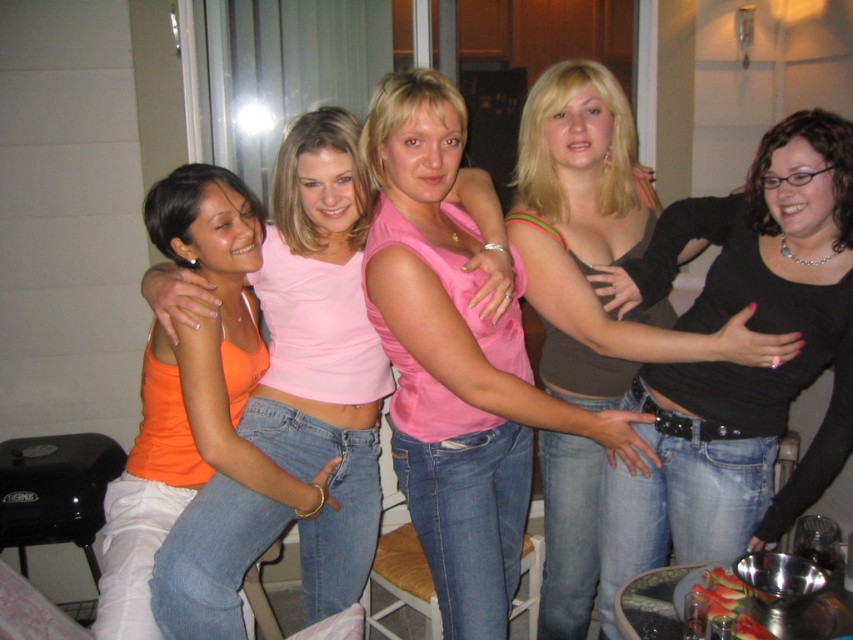
From the picture: Does pink matte tank top at center appear under orange matte tank top at center?

Actually, pink matte tank top at center is above orange matte tank top at center.

Who is positioned more to the right, pink matte tank top at center or orange matte tank top at center?

pink matte tank top at center

The width and height of the screenshot is (853, 640). What do you see at coordinates (456, 364) in the screenshot?
I see `pink matte tank top at center` at bounding box center [456, 364].

Identify the location of pink matte tank top at center. (456, 364).

The width and height of the screenshot is (853, 640). What do you see at coordinates (456, 364) in the screenshot?
I see `pink matte tank top at center` at bounding box center [456, 364].

Who is shorter, pink matte tank top at center or matte pink tank top at center?

pink matte tank top at center

This screenshot has height=640, width=853. I want to click on pink matte tank top at center, so pyautogui.click(x=456, y=364).

Is matte pink tank top at center closer to camera compared to orange matte tank top at center?

Yes, matte pink tank top at center is closer to the viewer.

Is point (592, 141) positioned before point (148, 508)?

Yes, point (592, 141) is in front of point (148, 508).

Describe the element at coordinates (596, 243) in the screenshot. I see `matte pink tank top at center` at that location.

Locate an element on the screen. The height and width of the screenshot is (640, 853). matte pink tank top at center is located at coordinates (596, 243).